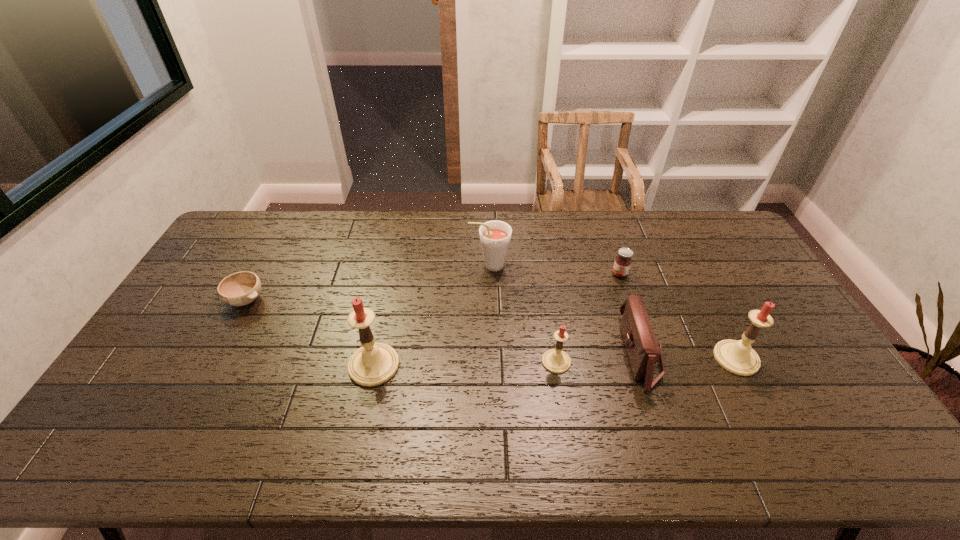
With all candles evenly spaced, where should an extra candle be placed on the left to continue the pattern? Please point out a vacant space. Please provide its 2D coordinates. Your answer should be formatted as a tuple, i.e. [(x, y)], where the tuple contains the x and y coordinates of a point satisfying the conditions above.

[(189, 369)]